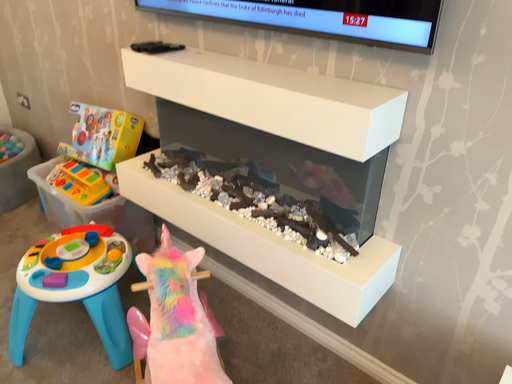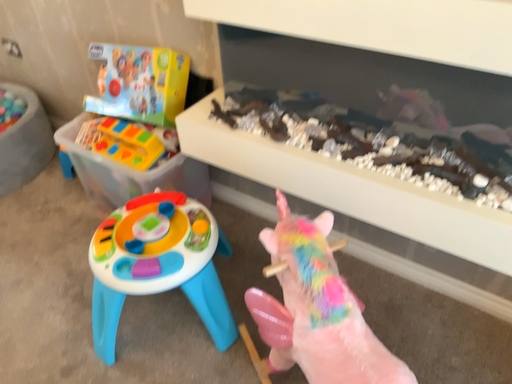
Question: How did the camera likely rotate when shooting the video?

Choices:
 (A) rotated downward
 (B) rotated upward

Answer: (A)